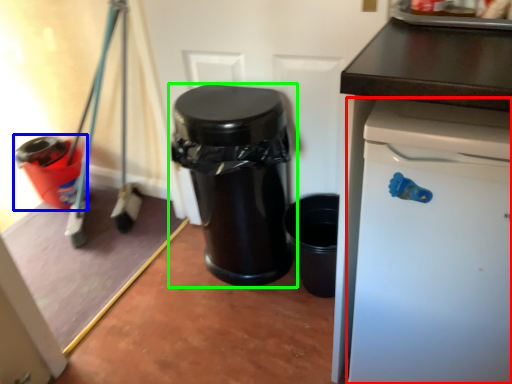
Question: Which object is the farthest from dish washer (highlighted by a red box)? Choose among these: waste container (highlighted by a blue box) or waste container (highlighted by a green box).

Choices:
 (A) waste container
 (B) waste container

Answer: (A)